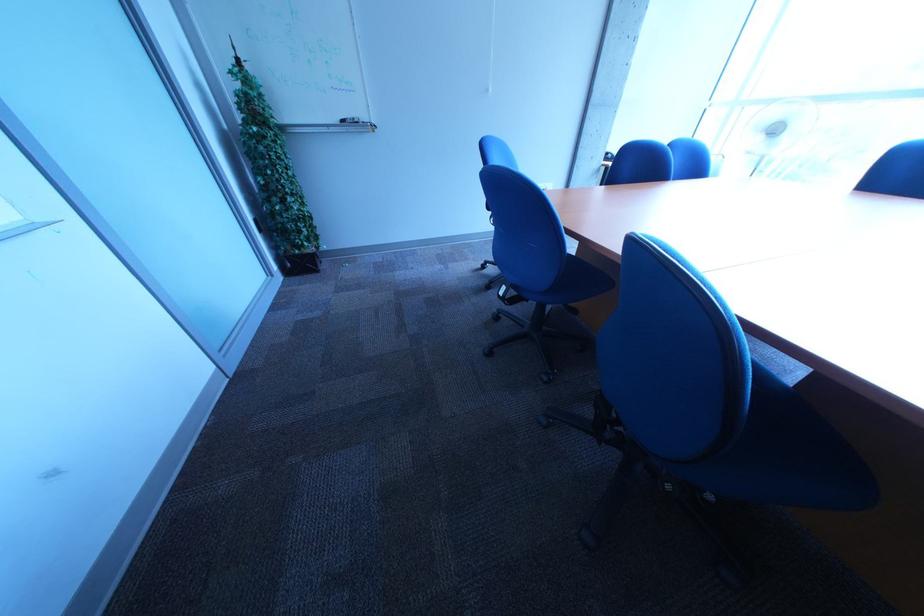
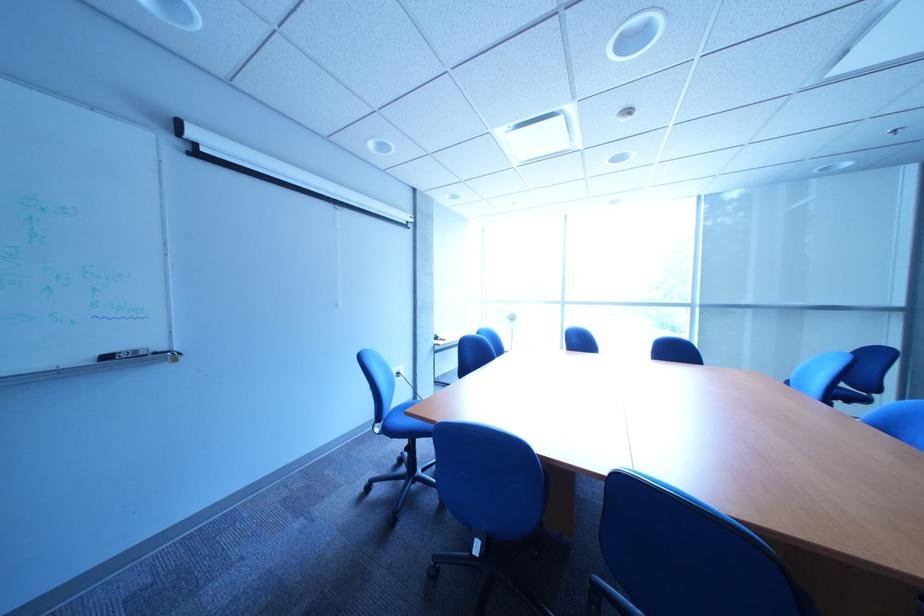
The point at [359,123] is marked in the first image. Where is the corresponding point in the second image?

(123, 359)